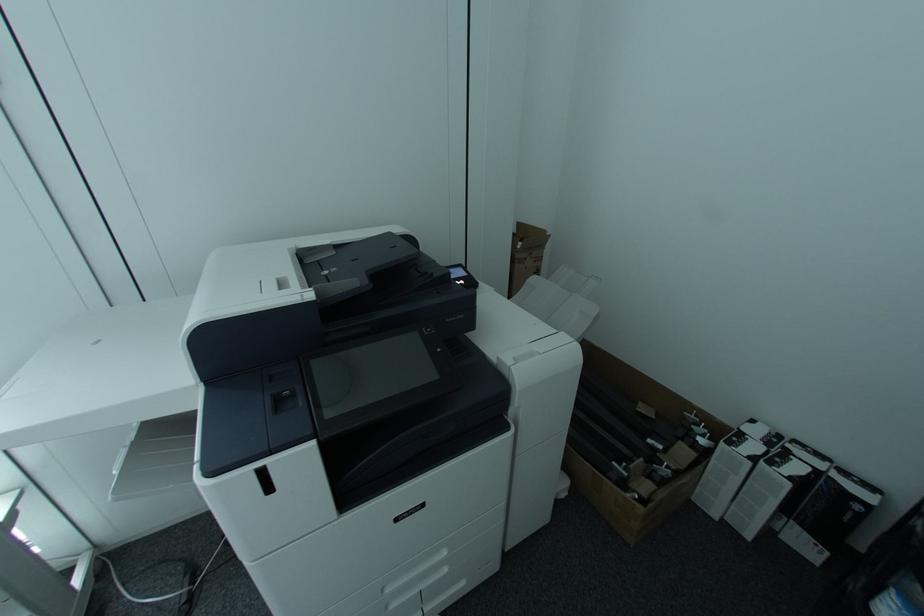
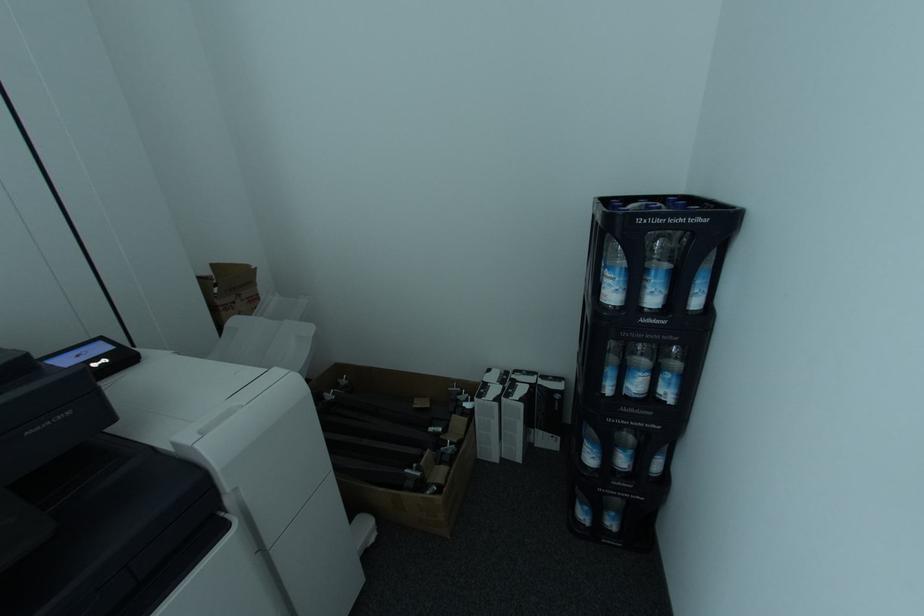
Question: The camera is either moving clockwise (left) or counter-clockwise (right) around the object. The first image is from the beginning of the video and the second image is from the end. Is the camera moving left or right when shooting the video?

Choices:
 (A) Left
 (B) Right

Answer: (A)